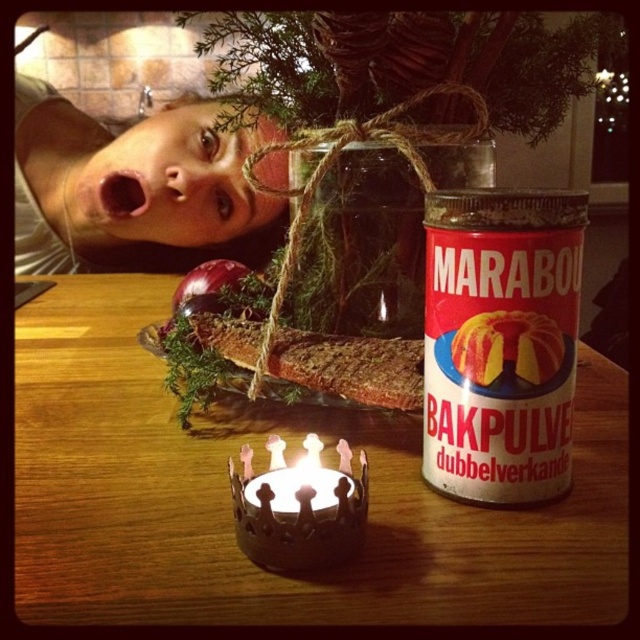
Question: Which of the following is the farthest from the observer?

Choices:
 (A) (273, 561)
 (B) (620, 420)
 (C) (330, 502)

Answer: (B)

Question: Which object appears closest to the camera in this image?

Choices:
 (A) metallic crown-shaped candle at lower center
 (B) matte white face at upper left
 (C) red matte tin can at right
 (D) wooden table at center

Answer: (D)

Question: Which of these objects is positioned closest to the metallic crown-shaped candle at lower center?

Choices:
 (A) red matte tin can at right
 (B) metallic crown-shaped candle at center
 (C) matte white face at upper left
 (D) wooden table at center

Answer: (B)

Question: Is wooden table at center bigger than matte white face at upper left?

Choices:
 (A) no
 (B) yes

Answer: (A)

Question: Can you confirm if red matte tin can at right is wider than metallic crown-shaped candle at center?

Choices:
 (A) yes
 (B) no

Answer: (A)

Question: Does wooden table at center appear over metallic crown-shaped candle at lower center?

Choices:
 (A) yes
 (B) no

Answer: (A)